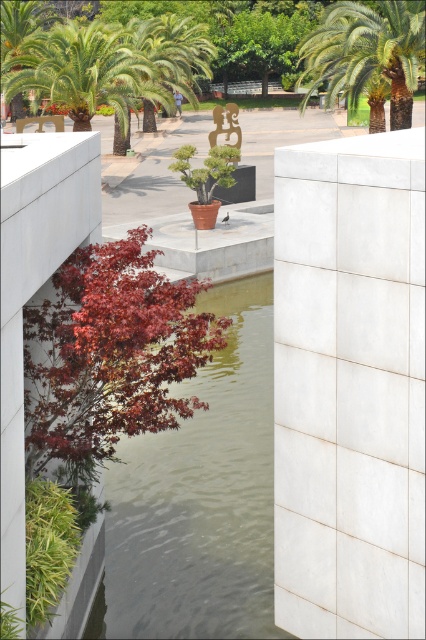
Question: Which object is farther from the camera taking this photo?

Choices:
 (A) green leafy palm tree at upper left
 (B) greenish water at center
 (C) green leafy palm tree at upper center

Answer: (A)

Question: Estimate the real-world distances between objects in this image. Which object is closer to the greenish water at center?

Choices:
 (A) green leafy palm tree at upper center
 (B) white concrete pillar at center
 (C) green leafy palm tree at upper left

Answer: (B)

Question: Which object appears farthest from the camera in this image?

Choices:
 (A) greenish water at center
 (B) white concrete pillar at center

Answer: (A)

Question: Does green leafy palm tree at upper center appear on the right side of green leafy palm tree at upper left?

Choices:
 (A) yes
 (B) no

Answer: (A)

Question: Does white concrete pillar at center have a smaller size compared to green leafy palm tree at upper center?

Choices:
 (A) yes
 (B) no

Answer: (A)

Question: Can you confirm if green leafy palm tree at upper center is positioned below green leafy palm tree at upper left?

Choices:
 (A) yes
 (B) no

Answer: (A)